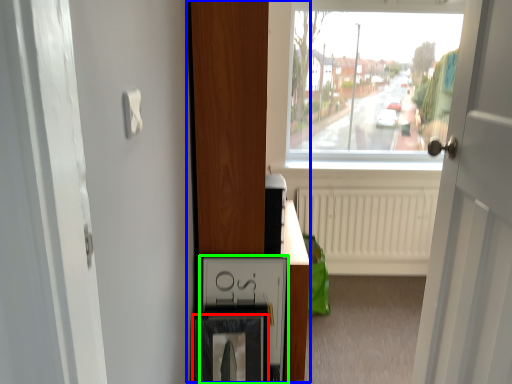
Question: Estimate the real-world distances between objects in this image. Which object is closer to picture frame (highlighted by a red box), dresser (highlighted by a blue box) or medicine cabinet (highlighted by a green box)?

Choices:
 (A) dresser
 (B) medicine cabinet

Answer: (B)